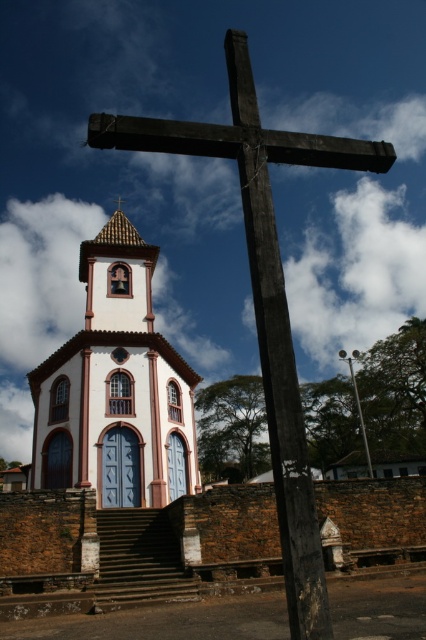
Does white matte church at center have a greater height compared to silver metallic pole at center?

Yes, white matte church at center is taller than silver metallic pole at center.

The image size is (426, 640). Describe the element at coordinates (115, 387) in the screenshot. I see `white matte church at center` at that location.

Is point (40, 484) farther from viewer compared to point (356, 384)?

That is False.

Where is `white matte church at center`? white matte church at center is located at coordinates (115, 387).

Which is below, white matte church at center or dark wood cross at upper center?

white matte church at center is lower down.

Which of these two, white matte church at center or dark wood cross at upper center, stands taller?

dark wood cross at upper center is taller.

Measure the distance between white matte church at center and camera.

46.23 meters

Find the location of a particular element. Image resolution: width=426 pixels, height=640 pixels. white matte church at center is located at coordinates (115, 387).

Which is behind, point (333, 156) or point (365, 445)?

Positioned behind is point (365, 445).

Is dark wood cross at upper center above silver metallic pole at center?

Indeed, dark wood cross at upper center is positioned over silver metallic pole at center.

Measure the distance between dark wood cross at upper center and camera.

dark wood cross at upper center and camera are 11.19 meters apart from each other.

I want to click on dark wood cross at upper center, so (264, 296).